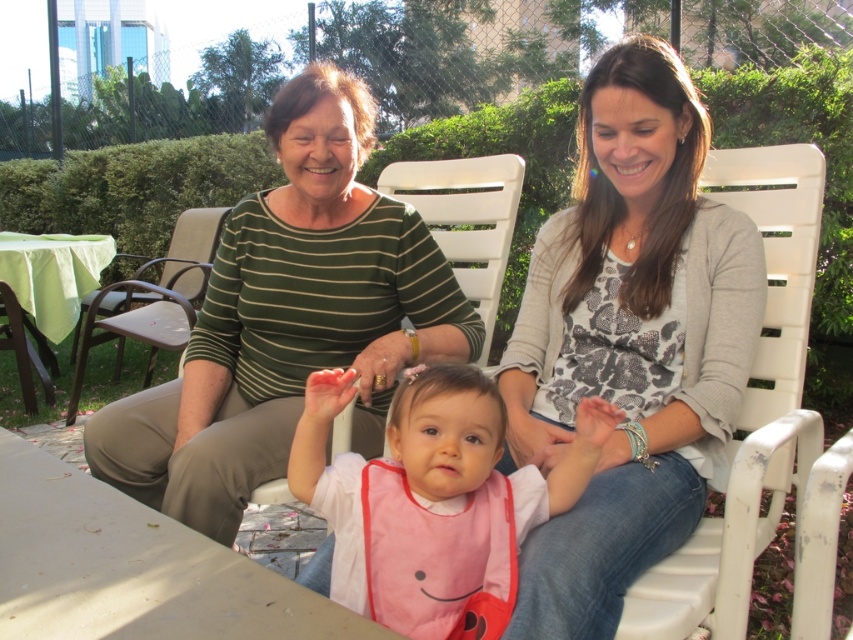
Question: Which object appears closest to the camera in this image?

Choices:
 (A) white plastic chair at right
 (B) brown leather chair at left

Answer: (A)

Question: In this image, where is matte gray sweater at center located relative to white plastic chair at right?

Choices:
 (A) left
 (B) right

Answer: (A)

Question: Estimate the real-world distances between objects in this image. Which object is farther from the white plastic chair at right?

Choices:
 (A) brown leather chair at left
 (B) pink fabric bib at center
 (C) white plastic chair at center

Answer: (A)

Question: Does matte gray sweater at center come in front of brown leather chair at left?

Choices:
 (A) yes
 (B) no

Answer: (A)

Question: Observing the image, what is the correct spatial positioning of white plastic chair at center in reference to brown leather chair at left?

Choices:
 (A) right
 (B) left

Answer: (A)

Question: Considering the real-world distances, which object is farthest from the white plastic chair at center?

Choices:
 (A) white plastic chair at right
 (B) brown leather chair at left
 (C) pink fabric bib at center
 (D) matte green sweater at center

Answer: (B)